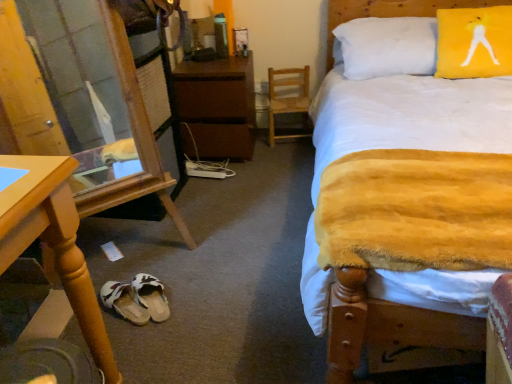
You are a GUI agent. You are given a task and a screenshot of the screen. Output one action in this format:
    pyautogui.click(x=<x>, y=<y>)
    Task: Click on the vacant area on the back side of white fabric sandals at lower center, placed as the second footwear when sorted from right to left
    This screenshot has width=512, height=384.
    Given the screenshot: What is the action you would take?
    pyautogui.click(x=139, y=267)